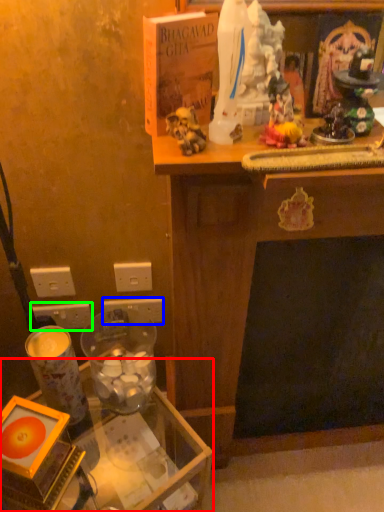
Question: Which object is positioned closest to table (highlighted by a red box)? Select from electric outlet (highlighted by a blue box) and electric outlet (highlighted by a green box).

Choices:
 (A) electric outlet
 (B) electric outlet

Answer: (A)